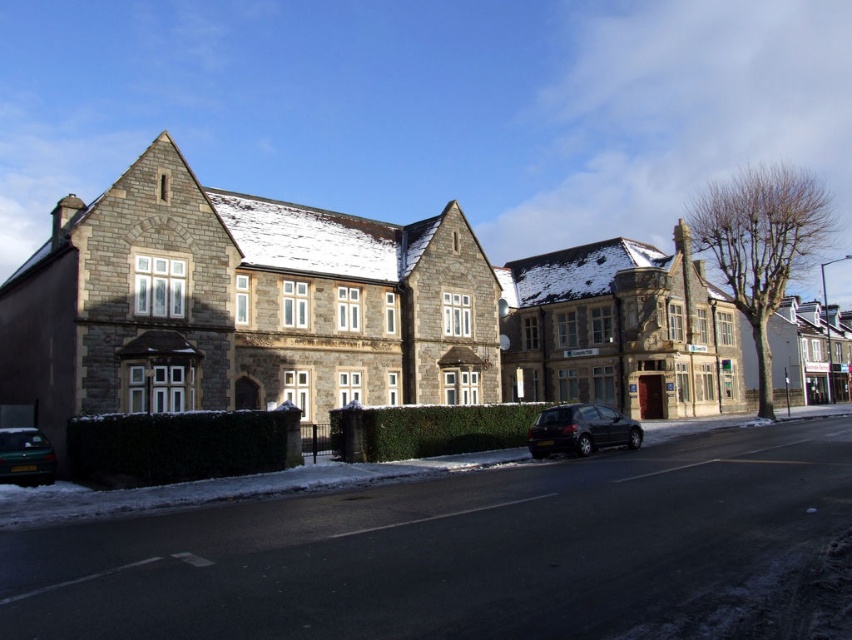
You are standing at the point marked as point [580,429] in the street scene. What type of vehicle is located exactly at your current position?

The shiny black hatchback at center is located exactly at point [580,429].

You are a delivery driver who needs to park your vehicle in this area. You see a shiny black hatchback at center and a green matte car at lower left. Which car is closer to the road on the right side of the street?

The shiny black hatchback at center is positioned on the right side of green matte car at lower left, so it is closer to the road on the right side of the street.

You are a delivery driver who needs to park your car in the street scene shown. The parking spot you want is located at coordinates 0.673, 0.682. Is your shiny black hatchback at center currently parked in that spot?

The position of shiny black hatchback at center is at point [580,429], so yes, the shiny black hatchback at center is currently parked in that spot.